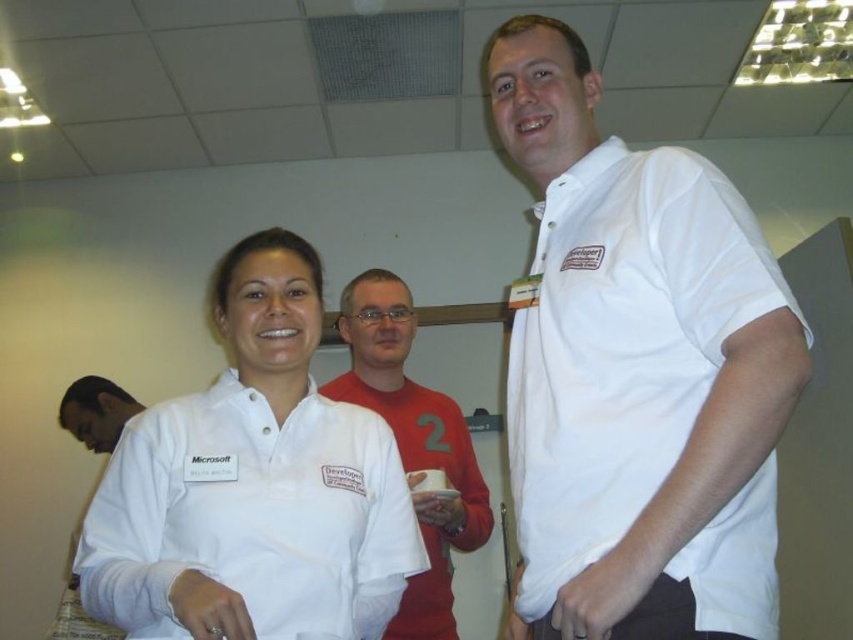
Question: Does white cotton shirt at upper right appear on the right side of red matte shirt at center?

Choices:
 (A) yes
 (B) no

Answer: (A)

Question: Based on their relative distances, which object is nearer to the dark skin smooth face at lower left?

Choices:
 (A) red matte shirt at center
 (B) white cotton shirt at upper right

Answer: (A)

Question: Is white cotton shirt at upper right to the left of red matte shirt at center from the viewer's perspective?

Choices:
 (A) yes
 (B) no

Answer: (B)

Question: Which object is the farthest from the dark skin smooth face at lower left?

Choices:
 (A) white cotton shirt at center
 (B) white cotton shirt at upper right

Answer: (B)

Question: Is white cotton shirt at upper right to the right of dark skin smooth face at lower left from the viewer's perspective?

Choices:
 (A) yes
 (B) no

Answer: (A)

Question: Which point is farther to the camera?

Choices:
 (A) white cotton shirt at upper right
 (B) white cotton shirt at center

Answer: (B)